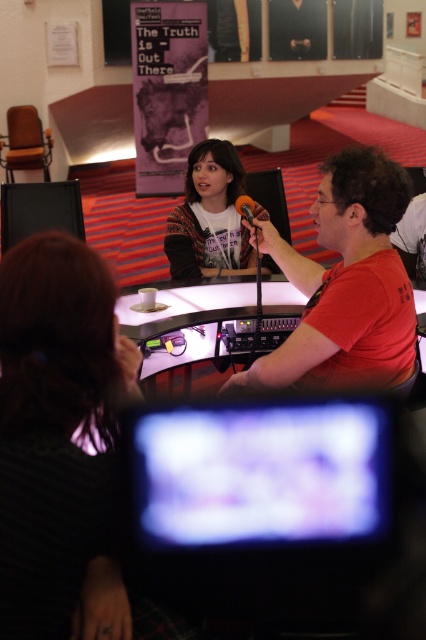
Question: Can you confirm if dark brown hair at lower left is positioned below black matte microphone at center?

Choices:
 (A) no
 (B) yes

Answer: (B)

Question: Considering the relative positions of dark brown hair at lower left and matte red shirt at center in the image provided, where is dark brown hair at lower left located with respect to matte red shirt at center?

Choices:
 (A) left
 (B) right

Answer: (A)

Question: Which object is closer to the camera taking this photo?

Choices:
 (A) white glossy table at center
 (B) blurred plastic screen at center
 (C) dark brown hair at lower left

Answer: (B)

Question: Which point is farther to the camera?

Choices:
 (A) (201, 328)
 (B) (236, 209)

Answer: (B)

Question: Is blurred plastic screen at center closer to the viewer compared to fuzzy sweater at center?

Choices:
 (A) no
 (B) yes

Answer: (B)

Question: Which object is positioned closest to the matte red shirt at center?

Choices:
 (A) fuzzy sweater at center
 (B) dark brown hair at lower left
 (C) black matte microphone at center

Answer: (C)